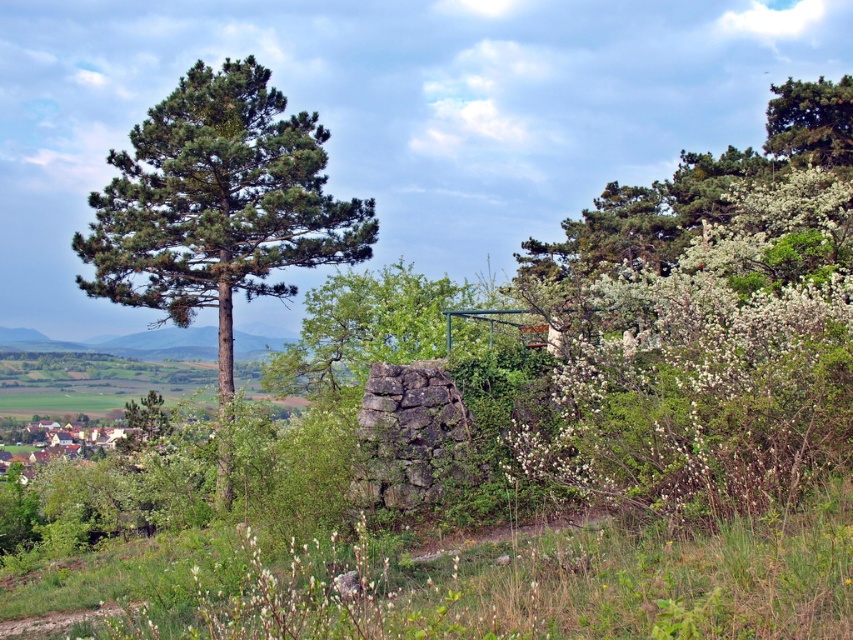
Question: Which of the following is the farthest from the observer?

Choices:
 (A) green leafy tree at center
 (B) green needle-like at left

Answer: (A)

Question: Which object appears farthest from the camera in this image?

Choices:
 (A) green needle-like at upper right
 (B) green needle-like at left
 (C) green leafy tree at center

Answer: (A)

Question: Is green needle-like at left wider than green leafy tree at center?

Choices:
 (A) yes
 (B) no

Answer: (A)

Question: Does green needle-like at left have a lesser width compared to green leafy tree at center?

Choices:
 (A) yes
 (B) no

Answer: (B)

Question: Which object appears closest to the camera in this image?

Choices:
 (A) green needle-like at left
 (B) green needle-like at upper right
 (C) green leafy tree at center

Answer: (A)

Question: Is green needle-like at left above green leafy tree at center?

Choices:
 (A) no
 (B) yes

Answer: (B)